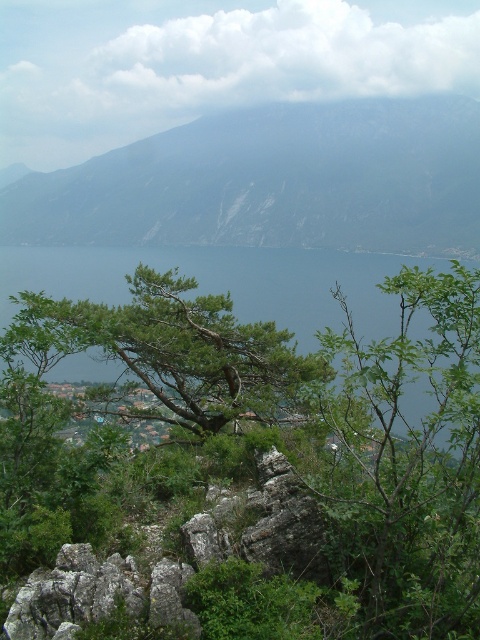
Is rocky gray mountain at upper center wider than green leafy tree at center?

Yes.

Is rocky gray mountain at upper center below green leafy tree at center?

No, rocky gray mountain at upper center is not below green leafy tree at center.

Locate an element on the screen. rocky gray mountain at upper center is located at coordinates (274, 180).

You are a GUI agent. You are given a task and a screenshot of the screen. Output one action in this format:
    pyautogui.click(x=<x>, y=<y>)
    Task: Click on the rocky gray mountain at upper center
    The height and width of the screenshot is (640, 480).
    Given the screenshot: What is the action you would take?
    pyautogui.click(x=274, y=180)

Which is behind, point (184, 148) or point (472, 449)?

Positioned behind is point (184, 148).

Is rocky gray mountain at upper center thinner than green leafy branch at center?

No.

Between point (184, 228) and point (410, 531), which one is positioned behind?

The point (184, 228) is behind.

Locate an element on the screen. rocky gray mountain at upper center is located at coordinates (274, 180).

Does green leafy branch at center have a greater width compared to green leafy tree at center?

Yes, green leafy branch at center is wider than green leafy tree at center.

Where is `green leafy branch at center`? This screenshot has width=480, height=640. green leafy branch at center is located at coordinates (x=408, y=460).

The image size is (480, 640). Find the location of `green leafy branch at center`. green leafy branch at center is located at coordinates (408, 460).